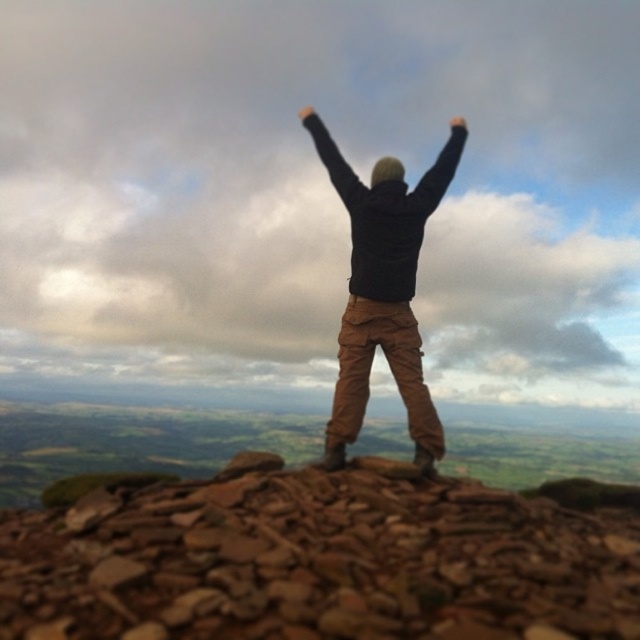
You are a photographer trying to capture the climber in the scene. You notice the black matte jacket at center and the black matte hand at upper center. Which object should you focus on first if you want to ensure both are in sharp focus?

The black matte jacket at center is in front of the black matte hand at upper center. To ensure both are in sharp focus, you should focus on the black matte hand at upper center first since it is farther away, allowing the depth of field to cover the closer jacket as well.

You are a hiker who has just reached the summit and wants to place a small flag on the highest point. You have the brown rough rocks at center and the black matte jacket at center in your view. Which object should you place the flag on to mark the highest elevation?

The black matte jacket at center is above the brown rough rocks at center, so placing the flag on the black matte jacket at center would mark the highest elevation.

You are a photographer trying to capture the scene of the person celebrating on the summit. You notice the brown rough rocks at center and the black matte hand at upper center in your viewfinder. Which object should you focus on first if you want to ensure the closest object is in sharp focus?

The brown rough rocks at center should be focused on first because they are closer to the viewer than the black matte hand at upper center, ensuring the closest object is in sharp focus.